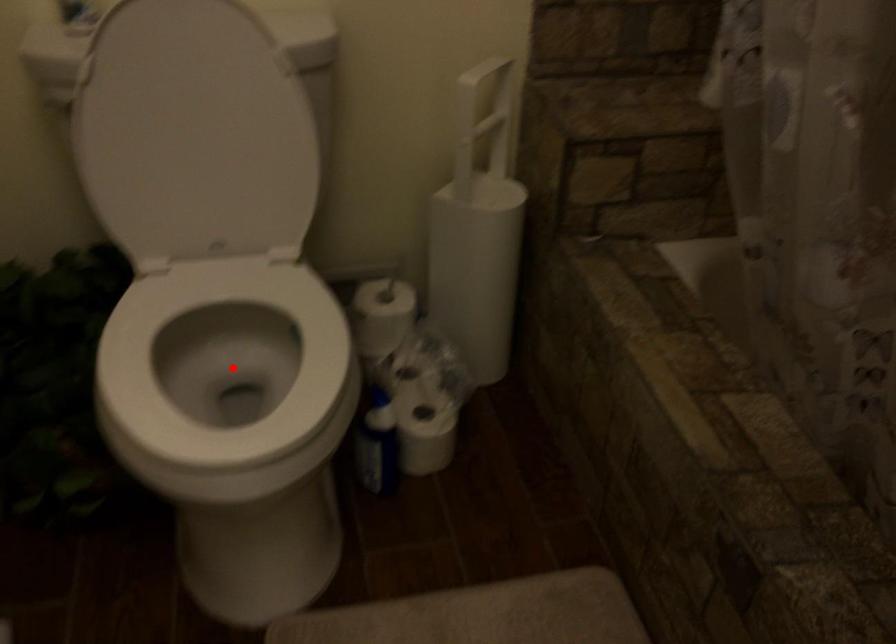
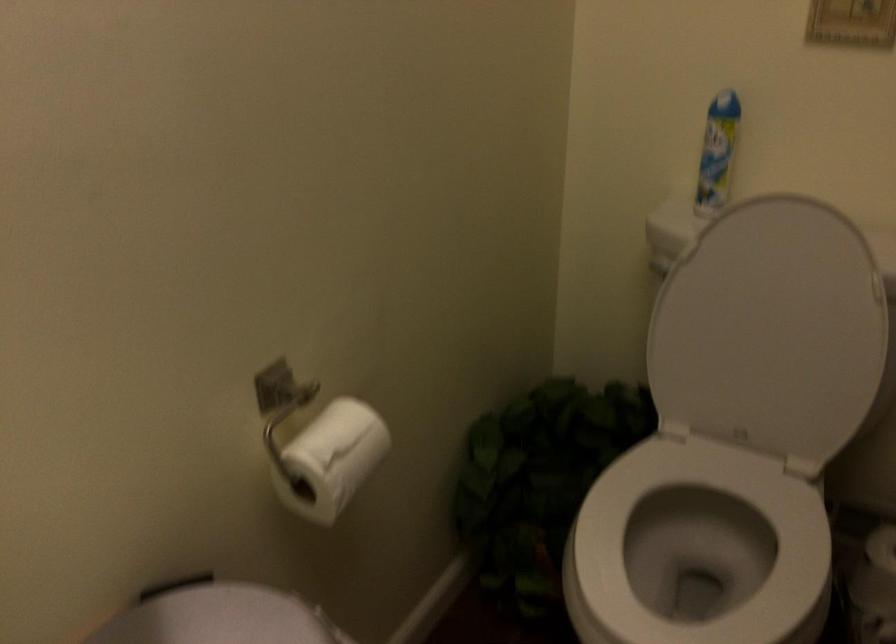
Question: I am providing you with two images of the same scene from different viewpoints. A red point is marked on the first image. Can you still see the location of the red point in image 2?

Choices:
 (A) Yes
 (B) No

Answer: (A)